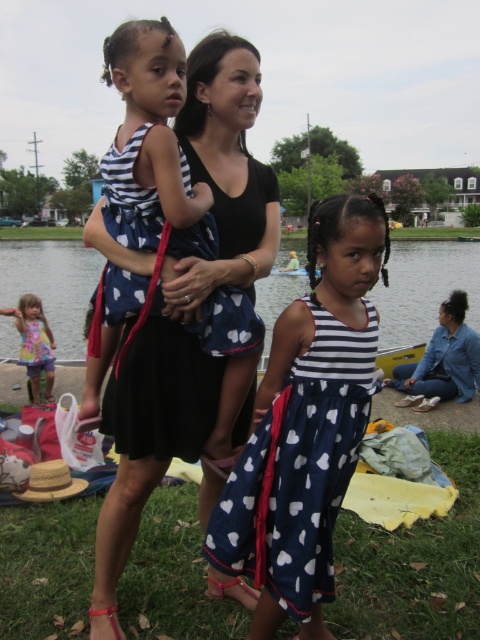
You are a photographer trying to frame a shot of the black matte dress at center in the image. Given that the dress is located at coordinates 0.483 on the x axis and 0.390 on the y axis, what is the dress position relative to the center of the image?

The black matte dress at center is positioned at coordinates 0.483 on the x axis and 0.390 on the y axis, which means it is slightly to the right and below the center of the image.